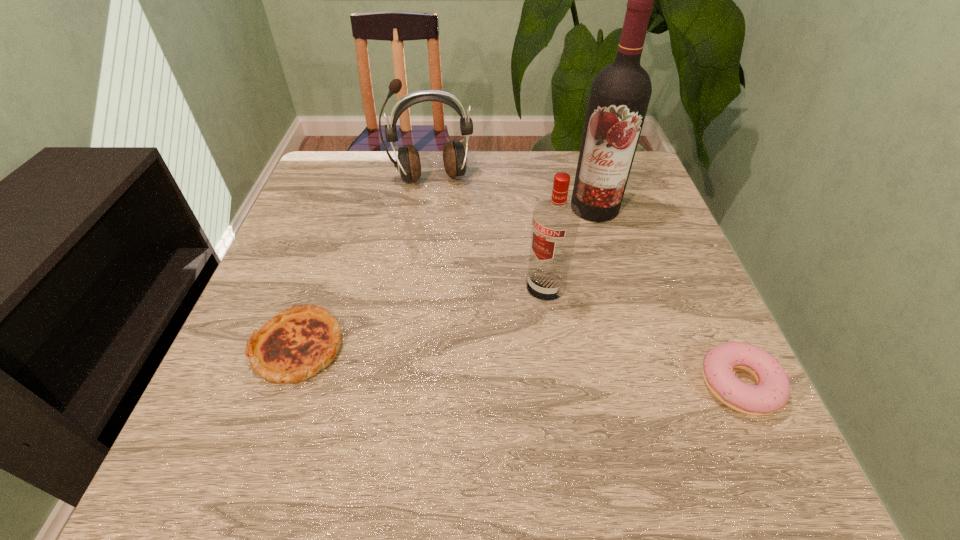
This screenshot has width=960, height=540. Find the location of `object located in the near right corner section of the desktop`. object located in the near right corner section of the desktop is located at coordinates (771, 393).

In the image, there is a desktop. At what (x,y) coordinates should I click in order to perform the action: click on vacant space at the far edge. Please return your answer as a coordinate pair (x, y). The height and width of the screenshot is (540, 960). Looking at the image, I should click on (486, 151).

This screenshot has width=960, height=540. In the image, there is a desktop. In order to click on free space at the left edge in this screenshot , I will do pyautogui.click(x=326, y=302).

Identify the location of free region at the right edge. (684, 339).

Identify the location of vacant region at the far left corner. This screenshot has height=540, width=960. (301, 200).

This screenshot has width=960, height=540. Find the location of `blank space at the far right corner of the desktop`. blank space at the far right corner of the desktop is located at coordinates (653, 195).

You are a GUI agent. You are given a task and a screenshot of the screen. Output one action in this format:
    pyautogui.click(x=<x>, y=<y>)
    Task: Click on the empty location between the rightmost object and the fourth object from right to left
    This screenshot has width=960, height=540.
    Given the screenshot: What is the action you would take?
    pyautogui.click(x=586, y=281)

The image size is (960, 540). Find the location of `vacant space in between the tallest object and the farthest object`. vacant space in between the tallest object and the farthest object is located at coordinates (513, 193).

The image size is (960, 540). Find the location of `empty space that is in between the rightmost object and the shortest object`. empty space that is in between the rightmost object and the shortest object is located at coordinates (518, 366).

This screenshot has height=540, width=960. I want to click on vacant area that lies between the farthest object and the second farthest object, so click(x=513, y=193).